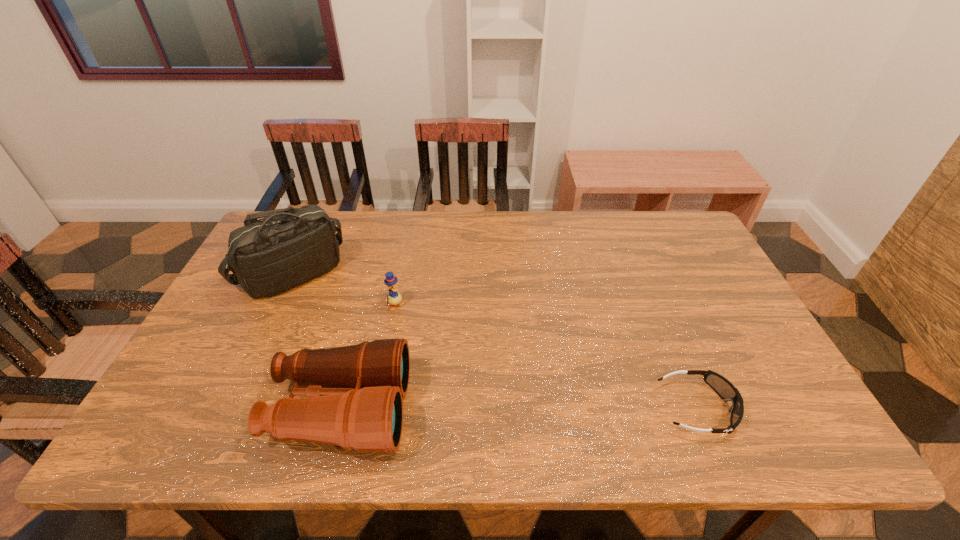
Locate an element on the screen. vacant space at the near edge is located at coordinates (283, 385).

This screenshot has height=540, width=960. In order to click on free space at the left edge of the desktop in this screenshot , I will do `click(246, 306)`.

The height and width of the screenshot is (540, 960). In order to click on vacant point at the right edge in this screenshot , I will do `click(711, 279)`.

You are a GUI agent. You are given a task and a screenshot of the screen. Output one action in this format:
    pyautogui.click(x=<x>, y=<y>)
    Task: Click on the free space at the near left corner of the desktop
    
    Given the screenshot: What is the action you would take?
    pyautogui.click(x=234, y=396)

Identify the location of free space at the far right corner of the desktop. The height and width of the screenshot is (540, 960). (676, 250).

This screenshot has height=540, width=960. In order to click on free spot between the binoculars and the rightmost object in this screenshot , I will do `click(518, 409)`.

Image resolution: width=960 pixels, height=540 pixels. Find the location of `free point between the tallest object and the duckling`. free point between the tallest object and the duckling is located at coordinates (345, 289).

This screenshot has height=540, width=960. In order to click on free area in between the rightmost object and the third tallest object in this screenshot , I will do `click(546, 357)`.

Locate an element on the screen. free area in between the tallest object and the third shortest object is located at coordinates (317, 342).

Where is `free spot between the rightmost object and the binoculars`? The width and height of the screenshot is (960, 540). free spot between the rightmost object and the binoculars is located at coordinates (518, 409).